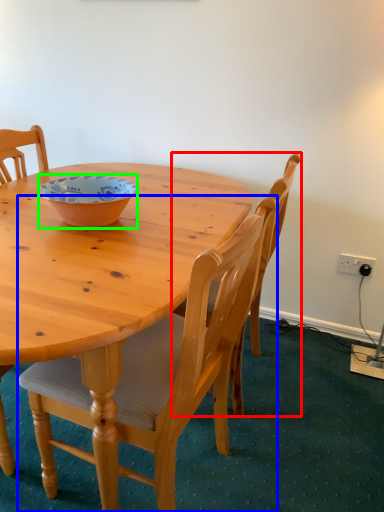
Question: Estimate the real-world distances between objects in this image. Which object is closer to chair (highlighted by a red box), chair (highlighted by a blue box) or bowl (highlighted by a green box)?

Choices:
 (A) chair
 (B) bowl

Answer: (A)